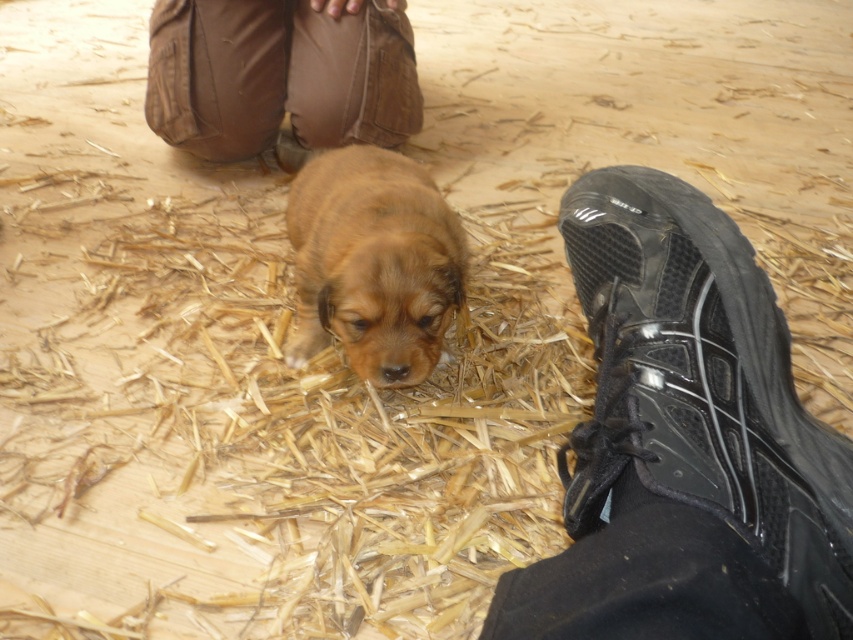
Question: Is black rubber shoe at lower right positioned behind brown fabric pants at upper center?

Choices:
 (A) yes
 (B) no

Answer: (B)

Question: Does black rubber shoe at lower right appear on the right side of brown fabric pants at upper center?

Choices:
 (A) no
 (B) yes

Answer: (B)

Question: Among these objects, which one is farthest from the camera?

Choices:
 (A) brown fabric pants at upper center
 (B) brown furry puppy at center
 (C) black rubber shoe at lower right

Answer: (A)

Question: Which point is farther to the camera?

Choices:
 (A) (732, 493)
 (B) (335, 122)

Answer: (B)

Question: Can you confirm if black rubber shoe at lower right is positioned above brown fabric pants at upper center?

Choices:
 (A) no
 (B) yes

Answer: (A)

Question: Based on their relative distances, which object is nearer to the black rubber shoe at lower right?

Choices:
 (A) brown fabric pants at upper center
 (B) brown furry puppy at center

Answer: (B)